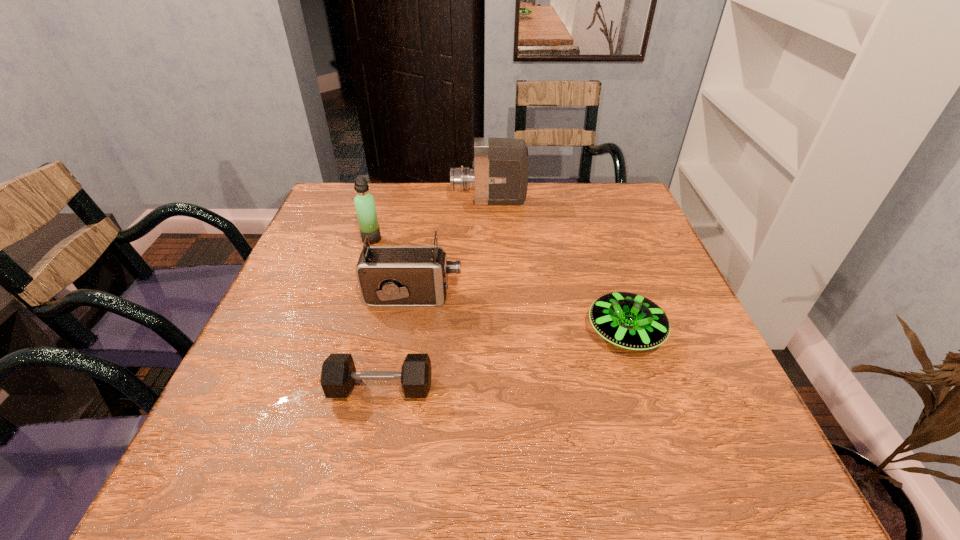
Identify which object is the second nearest to the saucer. Please provide its 2D coordinates. Your answer should be formatted as a tuple, i.e. [(x, y)], where the tuple contains the x and y coordinates of a point satisfying the conditions above.

[(338, 374)]

Image resolution: width=960 pixels, height=540 pixels. I want to click on object identified as the closest to the nearest object, so click(387, 275).

Identify the location of free spot that satisfies the following two spatial constraints: 1. at the front of the farther camcorder, highlighting the lens; 2. on the left side of the saucer. This screenshot has width=960, height=540. (493, 333).

The height and width of the screenshot is (540, 960). What are the coordinates of `free spot that satisfies the following two spatial constraints: 1. at the lens of the nearer camcorder; 2. on the back side of the rightmost object` in the screenshot? It's located at (407, 333).